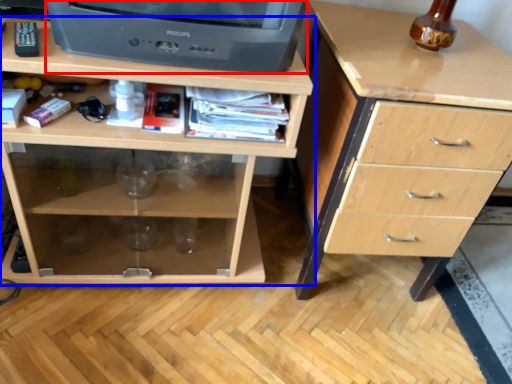
Question: Which object is closer to the camera taking this photo, television (highlighted by a red box) or chest of drawers (highlighted by a blue box)?

Choices:
 (A) television
 (B) chest of drawers

Answer: (A)